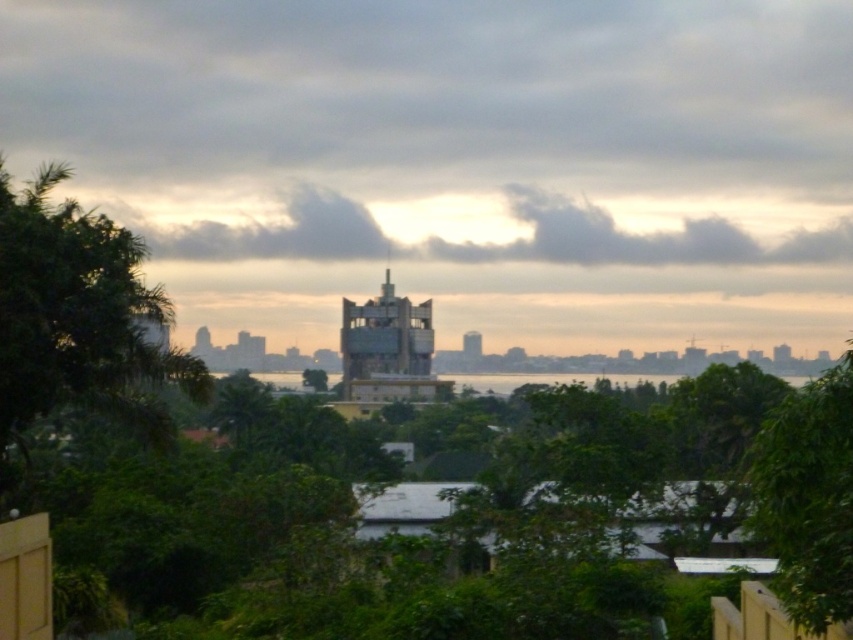
Question: Which is nearer to the gray fluffy cloud at upper center?

Choices:
 (A) green leafy tree at lower right
 (B) green leafy tree at center
 (C) green leafy tree at left
 (D) metallic glass tower at center

Answer: (B)

Question: Can you confirm if green leafy tree at left is bigger than metallic glass tower at center?

Choices:
 (A) yes
 (B) no

Answer: (B)

Question: Is metallic glass tower at center wider than smooth concrete tower at center?

Choices:
 (A) yes
 (B) no

Answer: (A)

Question: Is green leafy tree at lower right bigger than green leafy tree at center?

Choices:
 (A) no
 (B) yes

Answer: (B)

Question: Which object appears closest to the camera in this image?

Choices:
 (A) metallic glass tower at center
 (B) green leafy tree at left
 (C) gray fluffy cloud at upper center

Answer: (B)

Question: Which of these objects is positioned farthest from the green leafy tree at center?

Choices:
 (A) smooth concrete tower at center
 (B) gray fluffy cloud at upper center
 (C) green leafy tree at left

Answer: (C)